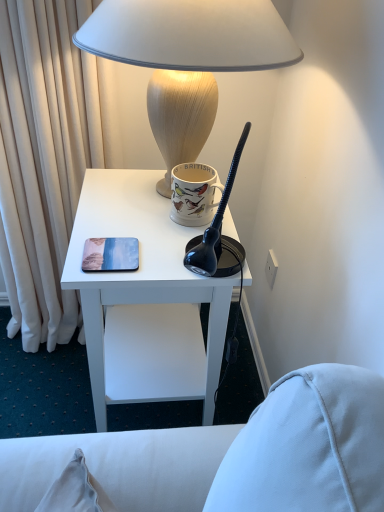
Identify the location of free spot above white matte desk at center (from a real-world perspective). The width and height of the screenshot is (384, 512). (135, 214).